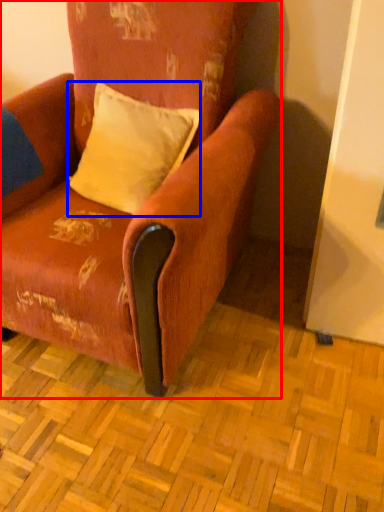
Question: Which point is further to the camera, chair (highlighted by a red box) or pillow (highlighted by a blue box)?

Choices:
 (A) chair
 (B) pillow

Answer: (B)